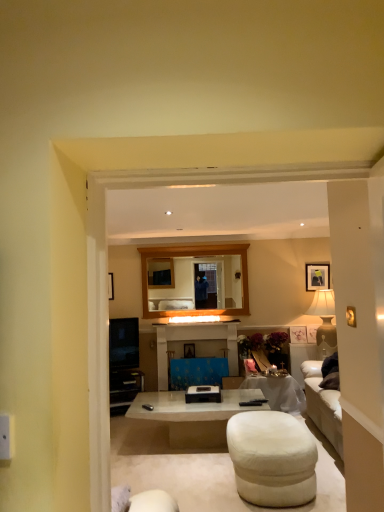
Question: Should I look upward or downward to see white fabric ottoman at lower center?

Choices:
 (A) down
 (B) up

Answer: (A)

Question: Does wooden-framed mirror at center lie behind white fabric ottoman at lower center?

Choices:
 (A) yes
 (B) no

Answer: (A)

Question: Is wooden-framed mirror at center located outside white fabric ottoman at lower center?

Choices:
 (A) yes
 (B) no

Answer: (A)

Question: Is wooden-framed mirror at center bigger than white fabric ottoman at lower center?

Choices:
 (A) no
 (B) yes

Answer: (A)

Question: Is wooden-framed mirror at center wider than white fabric ottoman at lower center?

Choices:
 (A) yes
 (B) no

Answer: (B)

Question: Can you see wooden-framed mirror at center touching white fabric ottoman at lower center?

Choices:
 (A) yes
 (B) no

Answer: (B)

Question: Is wooden-framed mirror at center not close to white fabric ottoman at lower center?

Choices:
 (A) yes
 (B) no

Answer: (A)

Question: Does white fabric ottoman at lower center contain white glossy coffee table at center?

Choices:
 (A) no
 (B) yes

Answer: (A)

Question: From a real-world perspective, is white fabric ottoman at lower center located beneath white glossy coffee table at center?

Choices:
 (A) yes
 (B) no

Answer: (B)

Question: Is white fabric ottoman at lower center further to the viewer compared to white glossy coffee table at center?

Choices:
 (A) no
 (B) yes

Answer: (A)

Question: Is white fabric ottoman at lower center positioned with its back to white glossy coffee table at center?

Choices:
 (A) no
 (B) yes

Answer: (A)

Question: Does white fabric ottoman at lower center have a lesser width compared to white glossy coffee table at center?

Choices:
 (A) no
 (B) yes

Answer: (B)

Question: Considering the relative sizes of white fabric ottoman at lower center and white glossy coffee table at center in the image provided, is white fabric ottoman at lower center wider than white glossy coffee table at center?

Choices:
 (A) yes
 (B) no

Answer: (B)

Question: From a real-world perspective, is white glossy coffee table at center positioned under white fabric ottoman at lower center based on gravity?

Choices:
 (A) yes
 (B) no

Answer: (A)